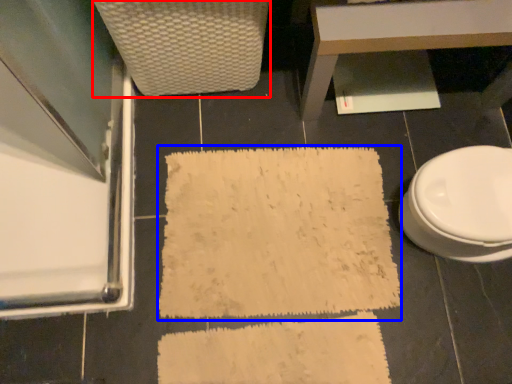
Question: Which object appears closest to the camera in this image, armchair (highlighted by a red box) or bath mat (highlighted by a blue box)?

Choices:
 (A) armchair
 (B) bath mat

Answer: (A)